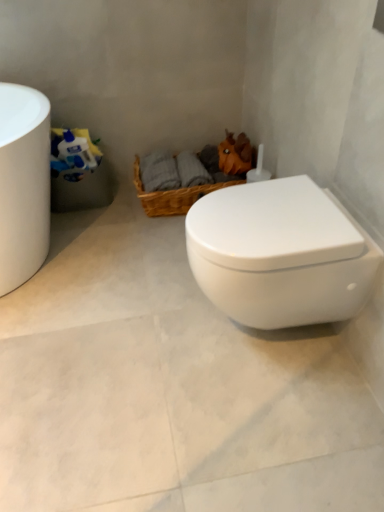
I want to click on free space in front of woven brown basket at center, so click(x=153, y=249).